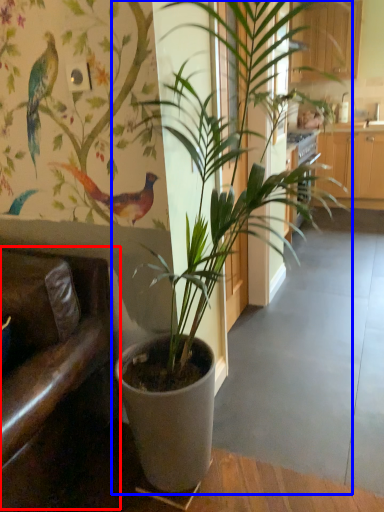
Question: Which object appears farthest to the camera in this image, armchair (highlighted by a red box) or houseplant (highlighted by a blue box)?

Choices:
 (A) armchair
 (B) houseplant

Answer: (A)